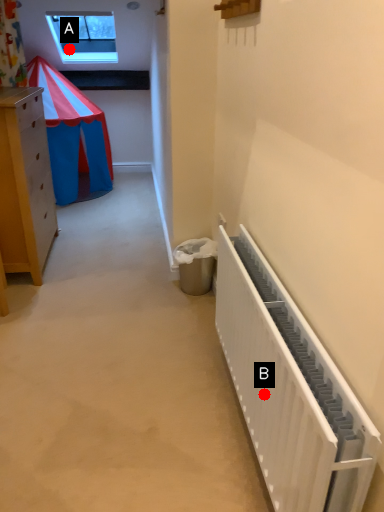
Question: Two points are circled on the image, labeled by A and B beside each circle. Which point appears closest to the camera in this image?

Choices:
 (A) A is closer
 (B) B is closer

Answer: (B)